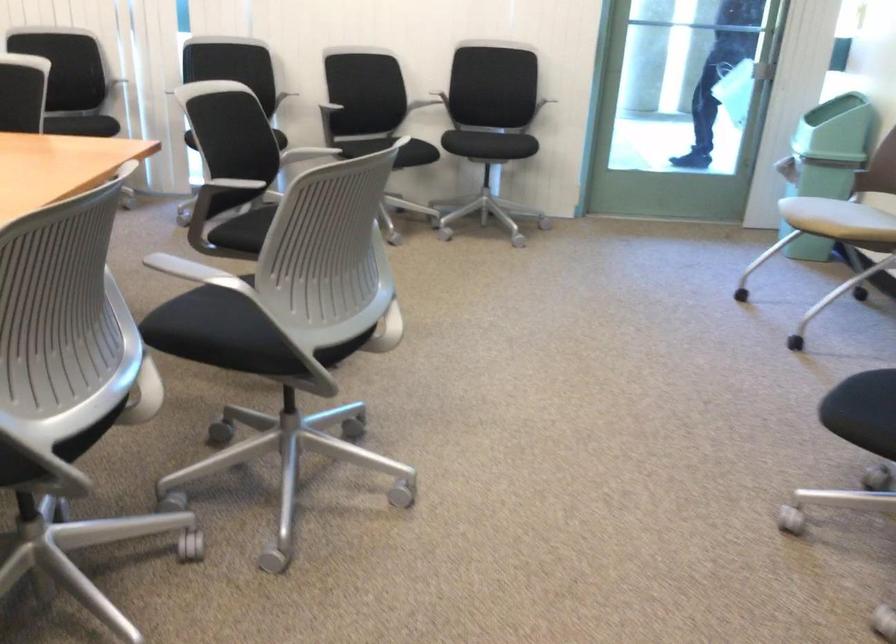
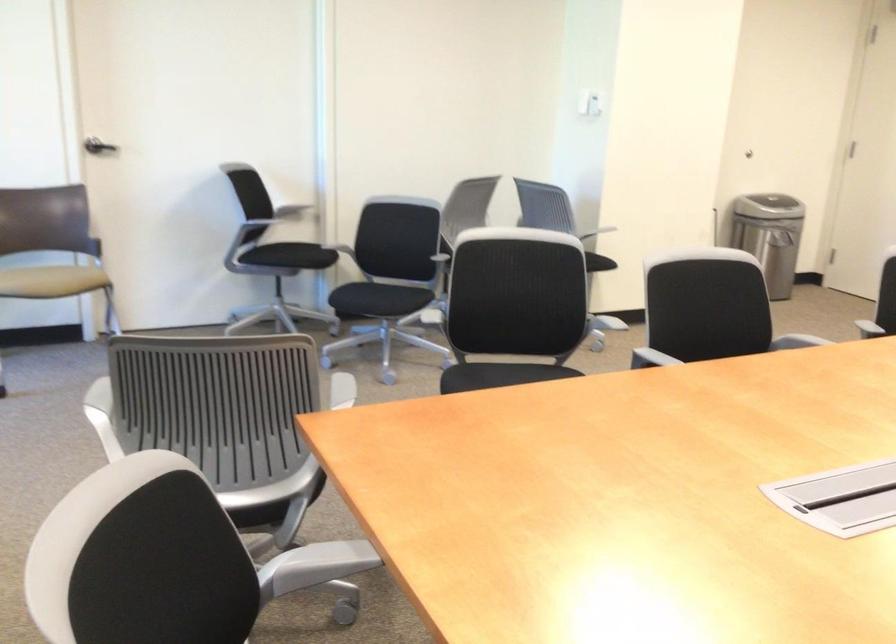
Locate, in the second image, the point that corresponds to point 345,249 in the first image.

(513, 307)